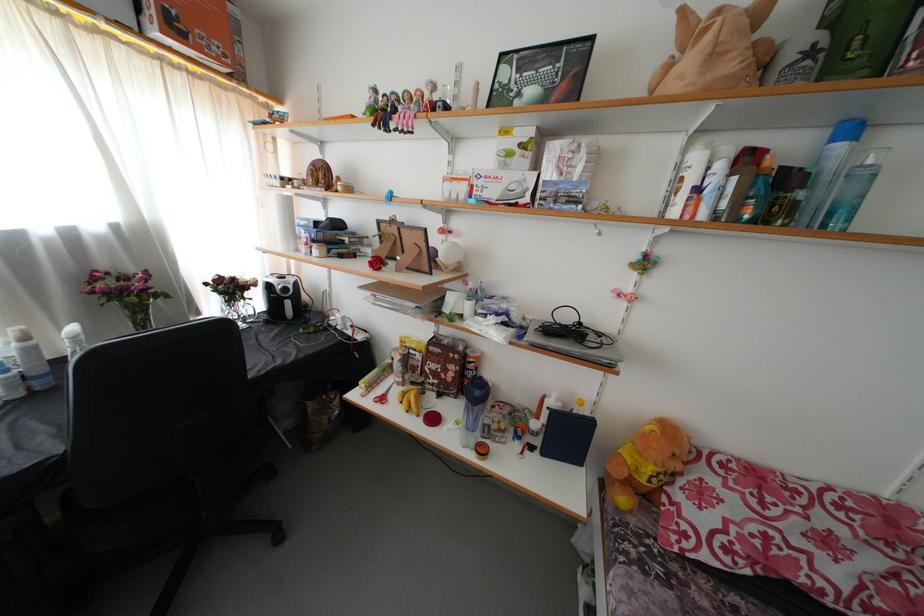
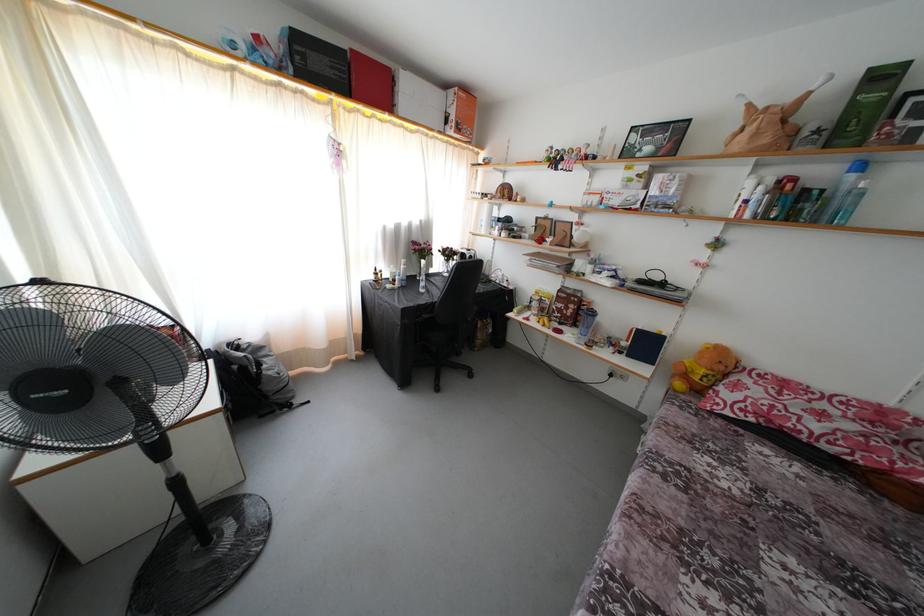
Where in the second image is the point corresponding to point 110,305 from the first image?

(422, 259)